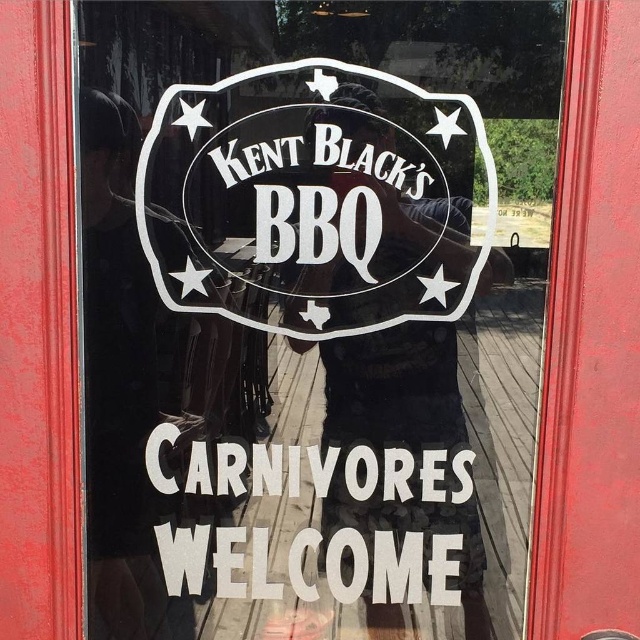
You are a customer standing outside the glass door of Kent Black s BBQ. You see two signs at the center of the door. Which one is positioned lower between the white matte sign at center and the white vinyl sign at center?

The white matte sign at center is located below the white vinyl sign at center, so the white matte sign at center is positioned lower.

You are a customer standing outside the glass door of Kent Black BBQ. You notice two white signs at the center of the door. Which one is thinner between the white matte sign at center and the white vinyl sign at center?

The white matte sign at center is thinner than the white vinyl sign at center.

You are standing outside the glass door of Kent Black BBQ and see both the white matte sign at center and the white vinyl sign at center. Which sign appears closer to you?

The white matte sign at center appears closer to you because it is further to the viewer than the white vinyl sign at center.